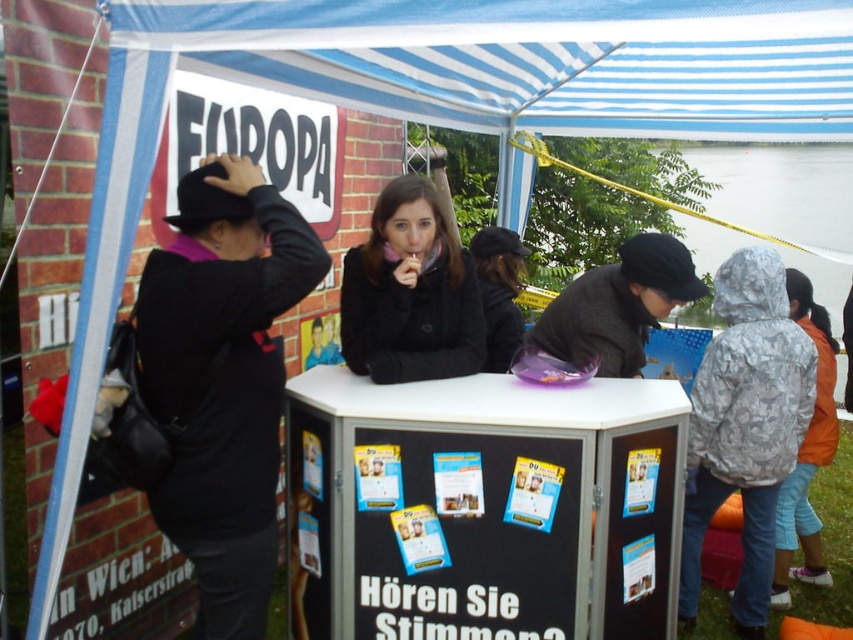
Based on the photo, you are standing at the entrance of the tent and want to reach both the point at coordinates point (756,19) and point (229,550). Which point is closer to you?

Point (756,19) is closer to the viewer than point (229,550), so you will reach point (756,19) first.